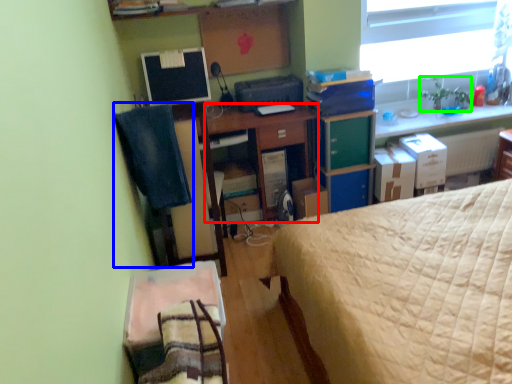
Question: Based on their relative distances, which object is nearer to desk (highlighted by a red box)? Choose from computer chair (highlighted by a blue box) and houseplant (highlighted by a green box).

Choices:
 (A) computer chair
 (B) houseplant

Answer: (A)